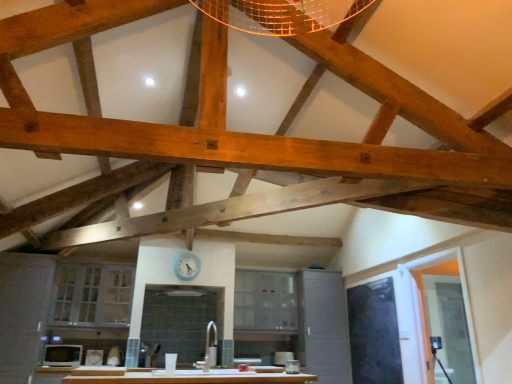
Question: Is matte white microwave at lower left bigger than white glass cabinet at lower left, positioned as the third cabinetry in right-to-left order?

Choices:
 (A) no
 (B) yes

Answer: (A)

Question: Is matte white microwave at lower left further to the viewer compared to white glass cabinet at lower left, the first cabinetry positioned from the left?

Choices:
 (A) no
 (B) yes

Answer: (A)

Question: Would you say matte white microwave at lower left is a long distance from white glass cabinet at lower left, positioned as the third cabinetry in right-to-left order?

Choices:
 (A) yes
 (B) no

Answer: (B)

Question: From a real-world perspective, is matte white microwave at lower left physically above white glass cabinet at lower left, the first cabinetry positioned from the left?

Choices:
 (A) yes
 (B) no

Answer: (B)

Question: Can you confirm if matte white microwave at lower left is positioned to the right of white glass cabinet at lower left, positioned as the third cabinetry in right-to-left order?

Choices:
 (A) yes
 (B) no

Answer: (B)

Question: From the image's perspective, relative to transparent glass door at right, is matte white microwave at lower left above or below?

Choices:
 (A) above
 (B) below

Answer: (B)

Question: From a real-world perspective, relative to transparent glass door at right, is matte white microwave at lower left vertically above or below?

Choices:
 (A) below
 (B) above

Answer: (A)

Question: In the image, is matte white microwave at lower left positioned in front of or behind transparent glass door at right?

Choices:
 (A) front
 (B) behind

Answer: (B)

Question: Is point click(x=58, y=359) positioned closer to the camera than point click(x=479, y=375)?

Choices:
 (A) closer
 (B) farther

Answer: (B)

Question: Looking at their shapes, would you say white glossy sink at center is wider or thinner than matte gray cabinet at center, which is the second cabinetry from left to right?

Choices:
 (A) wide
 (B) thin

Answer: (A)

Question: Does point (210, 365) appear closer or farther from the camera than point (238, 288)?

Choices:
 (A) closer
 (B) farther

Answer: (A)

Question: Is white glossy sink at center to the left or to the right of matte gray cabinet at center, which is the 2th cabinetry in right-to-left order, in the image?

Choices:
 (A) left
 (B) right

Answer: (A)

Question: From a real-world perspective, relative to matte gray cabinet at center, which is the 2th cabinetry in right-to-left order, is white glossy sink at center vertically above or below?

Choices:
 (A) below
 (B) above

Answer: (A)

Question: In terms of width, does white glossy sink at center look wider or thinner when compared to transparent glass door at right?

Choices:
 (A) wide
 (B) thin

Answer: (A)

Question: Considering the positions of point (207, 365) and point (461, 266), is point (207, 365) closer or farther from the camera than point (461, 266)?

Choices:
 (A) closer
 (B) farther

Answer: (B)